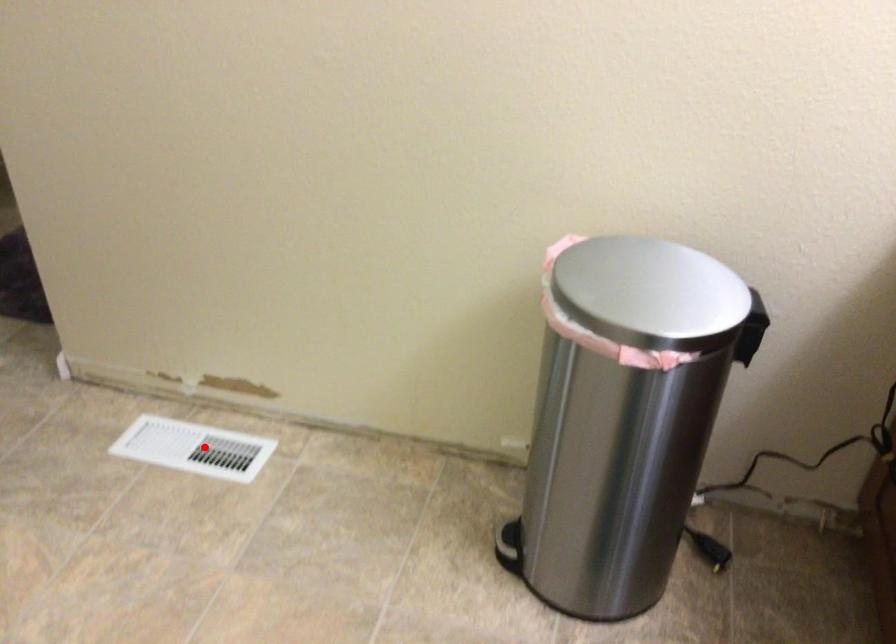
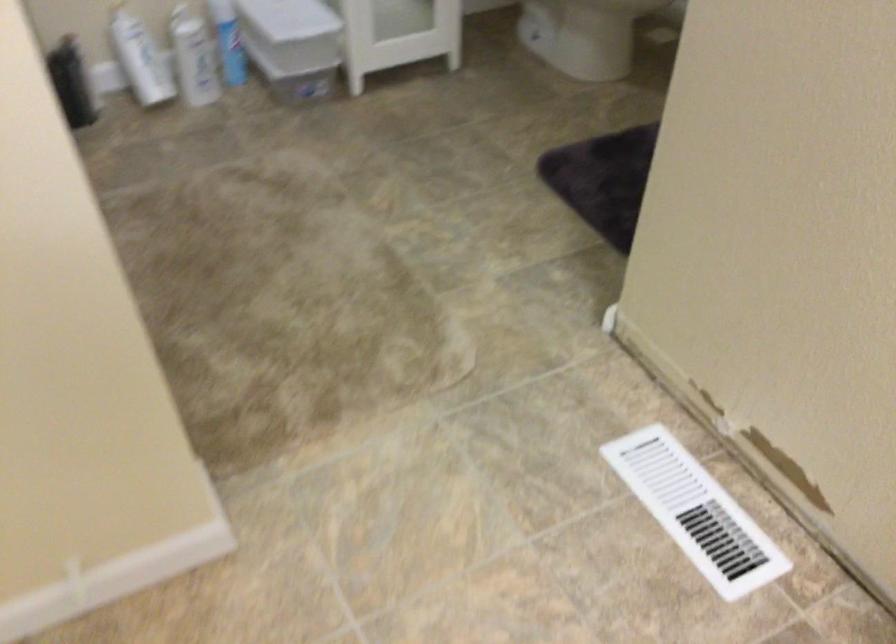
Question: I am providing you with two images of the same scene from different viewpoints. Given a red point in image1, look at the same physical point in image2. Is it:

Choices:
 (A) Closer to the viewpoint
 (B) Farther from the viewpoint

Answer: (A)